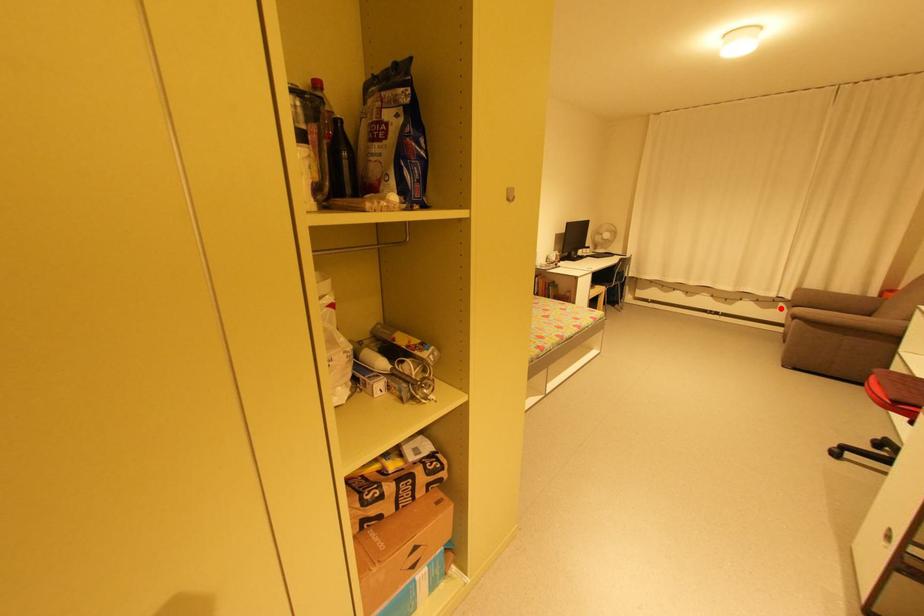
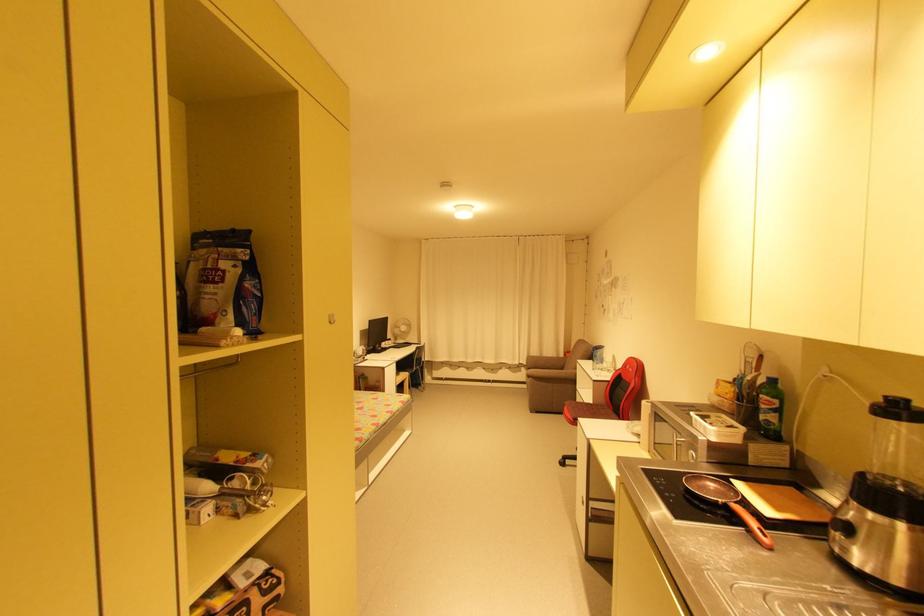
Question: A red point is marked in image1. In image2, is the corresponding 3D point closer to the camera or farther? Reply with the corresponding letter.

Choices:
 (A) The corresponding 3D point is closer.
 (B) The corresponding 3D point is farther.

Answer: (B)